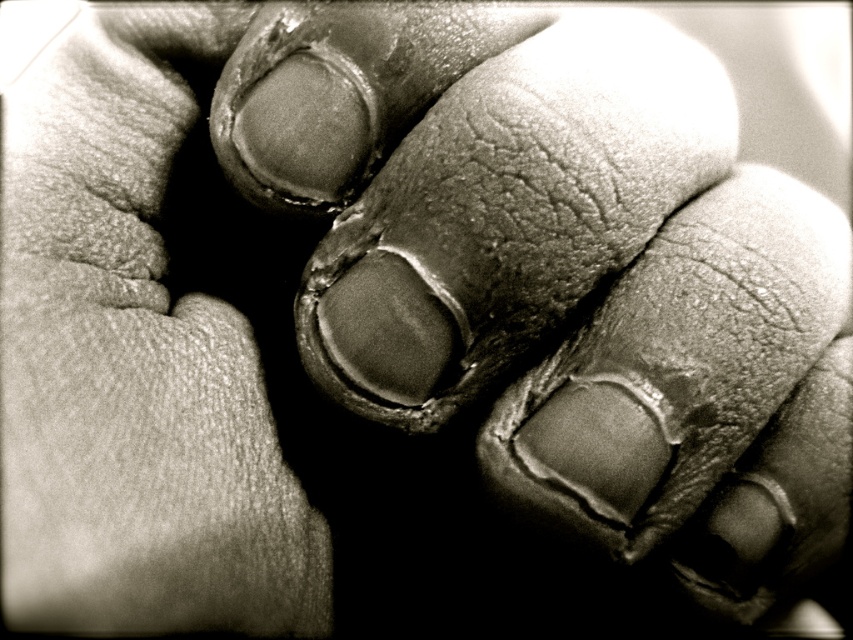
Can you confirm if smooth leather hand at center is positioned above leather glove at left?

No.

Who is positioned more to the right, smooth leather hand at center or leather glove at left?

smooth leather hand at center is more to the right.

Measure the distance between smooth leather hand at center and camera.

They are 15.62 inches apart.

This screenshot has height=640, width=853. I want to click on smooth leather hand at center, so click(666, 292).